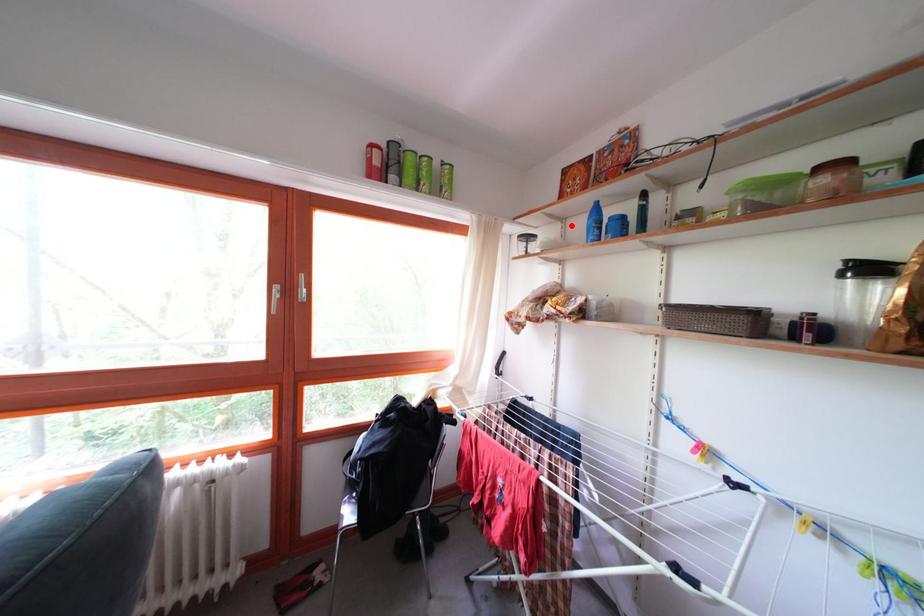
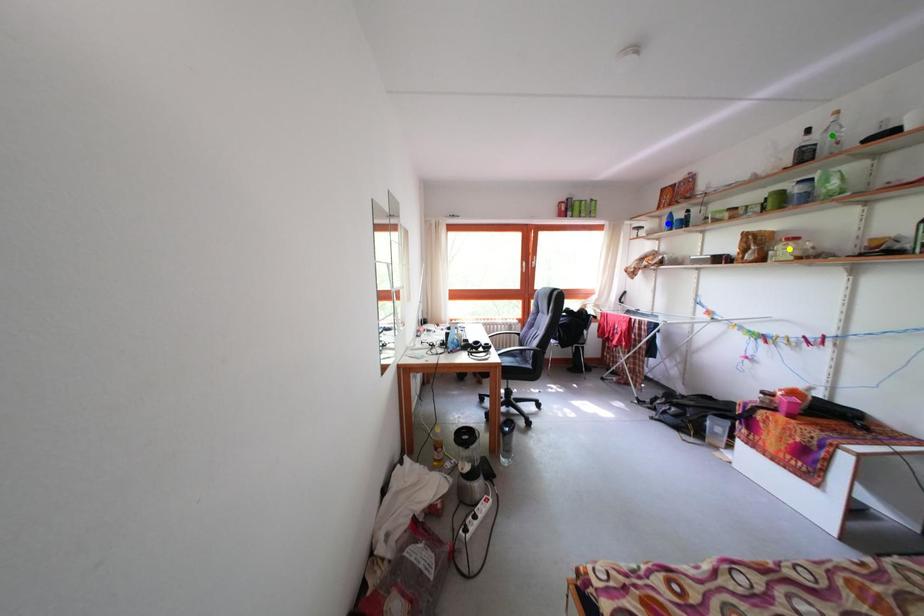
Question: I am providing you with two images of the same scene from different viewpoints. A red point is marked on the first image. You are given multiple points on the second image. Which point in image 2 represents the same 3d spot as the red point in image 1?

Choices:
 (A) green point
 (B) blue point
 (C) yellow point

Answer: (B)